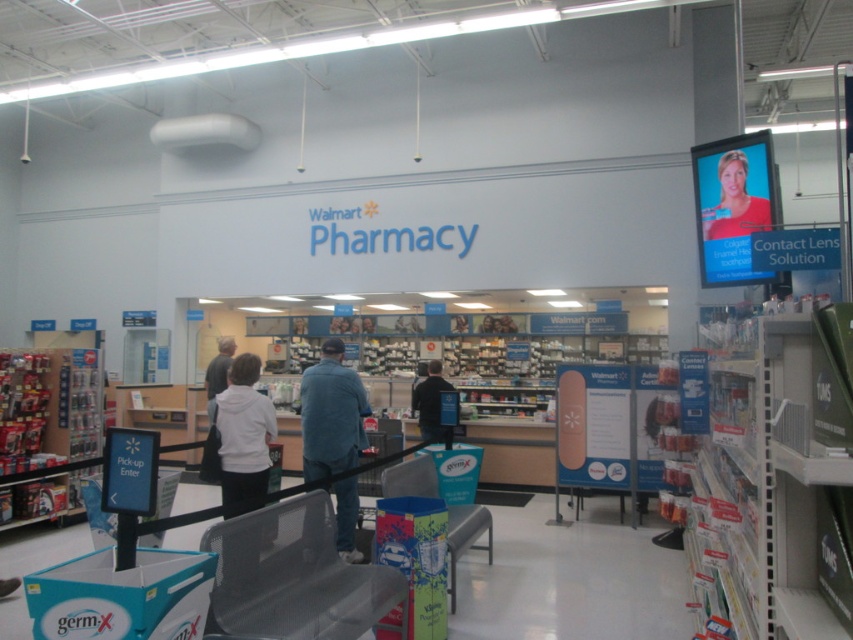
You are a customer in the Walmart Pharmacy section and need to maintain a 10 feet distance from others due to safety guidelines. You see a person wearing a white matte jacket at center and dark blue jeans at center. Can you safely approach them while keeping the required distance?

The distance between the white matte jacket at center and dark blue jeans at center is 10.72 feet, which exceeds the required 10 feet. Therefore, you can safely approach them while maintaining the necessary distance.